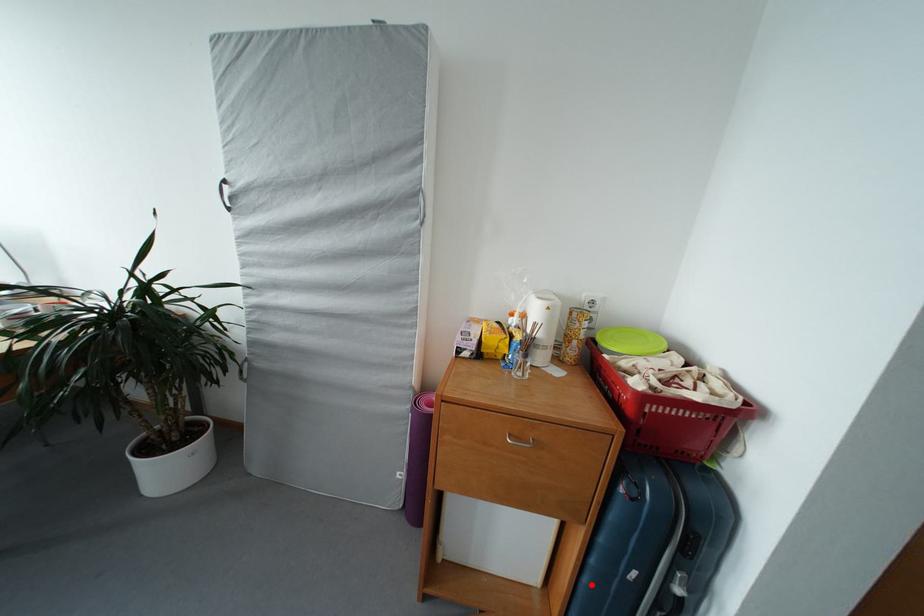
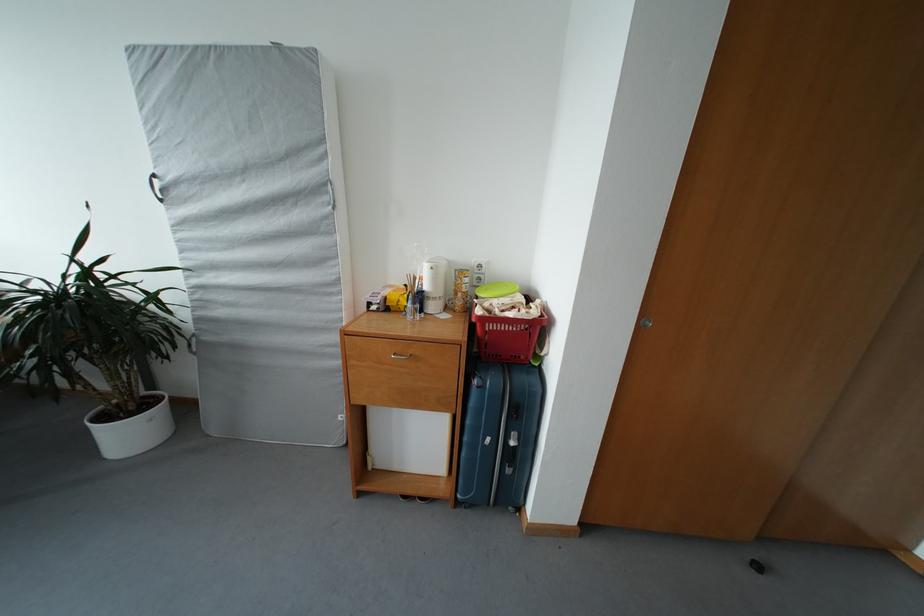
Find the pixel in the second image that matches the highlighted location in the first image.

(469, 459)